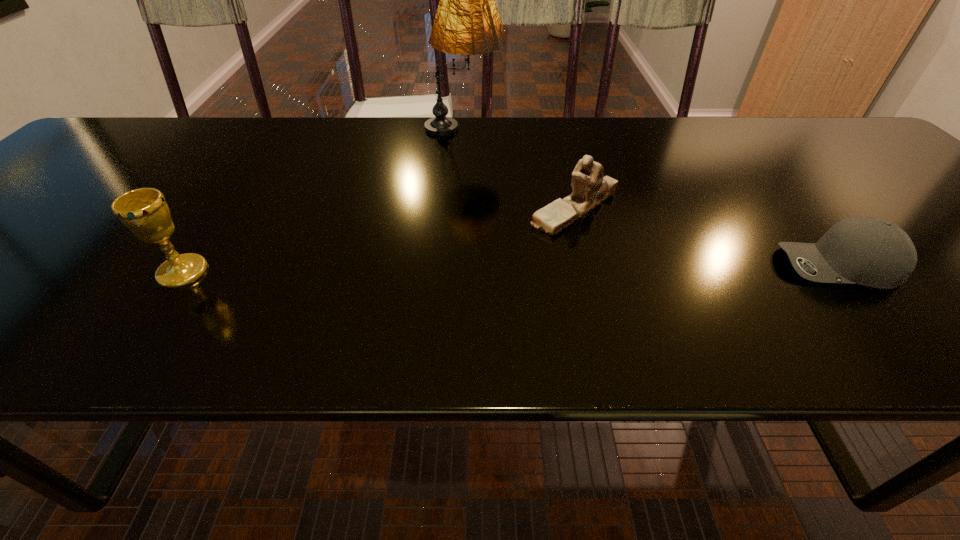
The height and width of the screenshot is (540, 960). Find the location of `the third object from right to left`. the third object from right to left is located at coordinates (467, 22).

Where is `the tallest object`? the tallest object is located at coordinates (467, 22).

Identify the location of the leftmost object. (144, 211).

Find the location of `chalice`. chalice is located at coordinates coord(144,211).

What are the coordinates of `the third nearest object` in the screenshot? It's located at (590, 188).

Locate an element on the screen. Image resolution: width=960 pixels, height=540 pixels. the second shortest object is located at coordinates (590, 188).

Find the location of a particular element. The width and height of the screenshot is (960, 540). the shortest object is located at coordinates (873, 252).

The height and width of the screenshot is (540, 960). I want to click on the rightmost object, so click(873, 252).

You are a GUI agent. You are given a task and a screenshot of the screen. Output one action in this format:
    pyautogui.click(x=<x>, y=<y>)
    Task: Click on the free region located on the front-facing side of the farthest object
    The width and height of the screenshot is (960, 540).
    Given the screenshot: What is the action you would take?
    pyautogui.click(x=529, y=132)

This screenshot has width=960, height=540. Identify the location of free region located 0.070m on the front of the chalice. (151, 319).